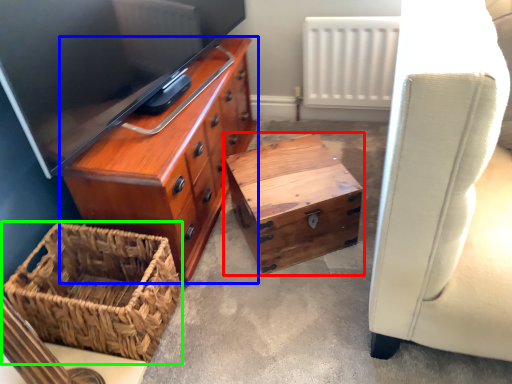
Question: Considering the real-world distances, which object is farthest from table (highlighted by a red box)? chest of drawers (highlighted by a blue box) or picnic basket (highlighted by a green box)?

Choices:
 (A) chest of drawers
 (B) picnic basket

Answer: (B)